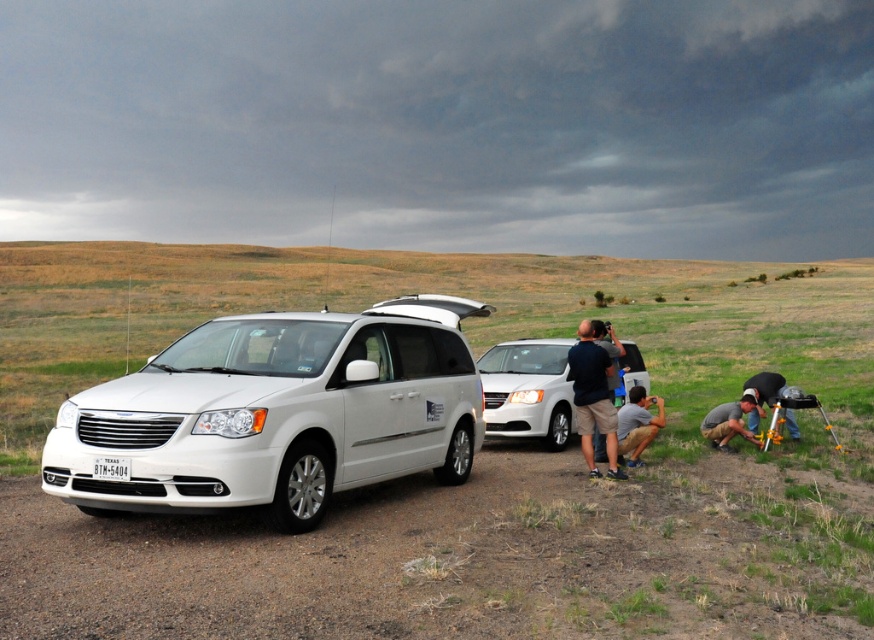
Question: Which of the following is the farthest from the observer?

Choices:
 (A) (711, 428)
 (B) (128, 465)

Answer: (A)

Question: Does white matte van at center have a greater width compared to matte black camera at center?

Choices:
 (A) no
 (B) yes

Answer: (A)

Question: Does dirt track at lower left have a greater width compared to white matte minivan at center?

Choices:
 (A) no
 (B) yes

Answer: (B)

Question: Can you confirm if dirt track at lower left is thinner than matte black camera at center?

Choices:
 (A) yes
 (B) no

Answer: (B)

Question: Considering the real-world distances, which object is farthest from the white matte minivan at center?

Choices:
 (A) metallic silver tripod at lower right
 (B) matte black camera at center

Answer: (A)

Question: Which of these objects is positioned farthest from the metallic silver tripod at lower right?

Choices:
 (A) dirt track at lower left
 (B) green grass at lower right
 (C) white matte minivan at center

Answer: (B)